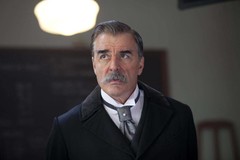
The height and width of the screenshot is (160, 240). In order to click on ceiling support in this screenshot , I will do `click(191, 4)`.